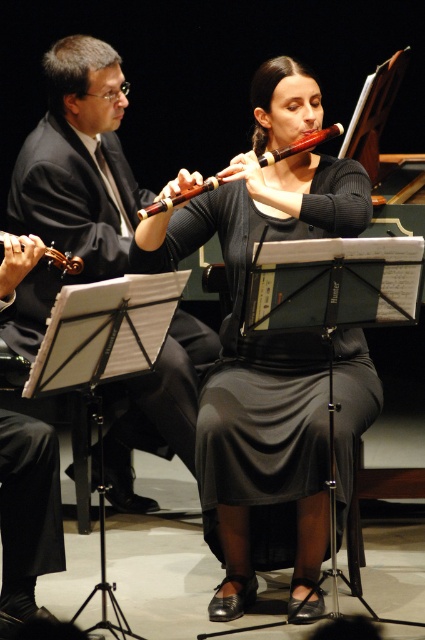
Can you confirm if matte black flute at center is smaller than brushed metal violin at left?

Actually, matte black flute at center might be larger than brushed metal violin at left.

Which is behind, point (285, 74) or point (71, 257)?

Point (285, 74)

You are a GUI agent. You are given a task and a screenshot of the screen. Output one action in this format:
    pyautogui.click(x=<x>, y=<y>)
    Task: Click on the matte black flute at center
    
    Given the screenshot: What is the action you would take?
    pyautogui.click(x=265, y=339)

Which is more to the left, matte black suit at left or wooden flute at center?

From the viewer's perspective, matte black suit at left appears more on the left side.

Is matte black suit at left taller than wooden flute at center?

Correct, matte black suit at left is much taller as wooden flute at center.

Does point (31, 291) come farther from viewer compared to point (147, 216)?

Yes, it is.

This screenshot has height=640, width=425. I want to click on matte black suit at left, so click(x=79, y=163).

This screenshot has width=425, height=640. What do you see at coordinates (265, 339) in the screenshot?
I see `matte black flute at center` at bounding box center [265, 339].

Consider the image. Is matte black flute at center smaller than wooden flute at center?

No, matte black flute at center is not smaller than wooden flute at center.

Locate an element on the screen. This screenshot has height=640, width=425. matte black flute at center is located at coordinates (265, 339).

Image resolution: width=425 pixels, height=640 pixels. I want to click on matte black flute at center, so click(x=265, y=339).